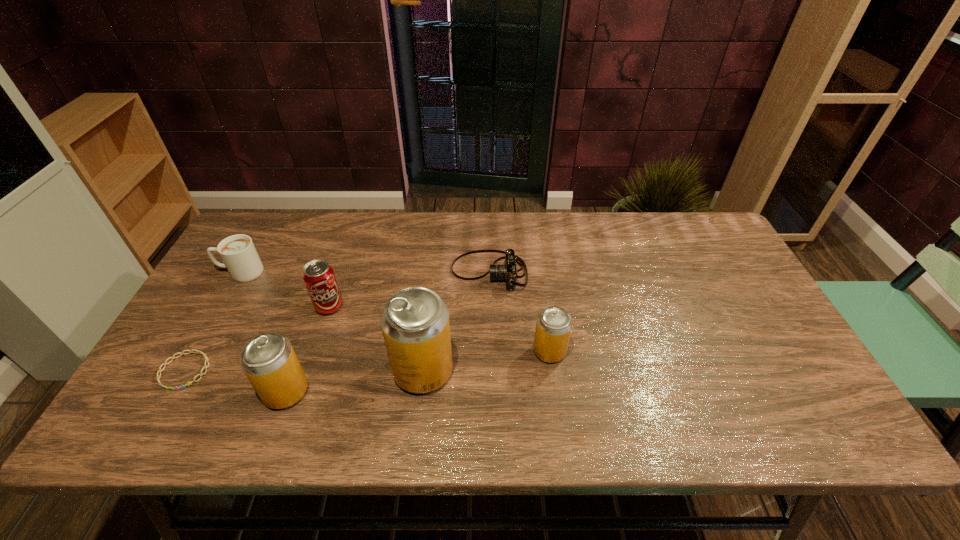
At what (x,y) coordinates should I click in order to perform the action: click on the tallest soda. Please return your answer as a coordinate pair (x, y). The image size is (960, 540). Looking at the image, I should click on (415, 323).

At what (x,y) coordinates should I click in order to perform the action: click on the second soda from right to left. Please return your answer as a coordinate pair (x, y). This screenshot has height=540, width=960. Looking at the image, I should click on (415, 323).

Where is `the rightmost soda`? the rightmost soda is located at coordinates (553, 328).

You are a GUI agent. You are given a task and a screenshot of the screen. Output one action in this format:
    pyautogui.click(x=<x>, y=<y>)
    Task: Click on the camera
    
    Given the screenshot: What is the action you would take?
    click(x=507, y=272)

Locate an element on the screen. Image resolution: width=960 pixels, height=540 pixels. the farthest soda is located at coordinates (318, 275).

This screenshot has height=540, width=960. I want to click on cappuccino, so click(x=238, y=252).

You are a GUI agent. You are given a task and a screenshot of the screen. Output one action in this format:
    pyautogui.click(x=<x>, y=<y>)
    Task: Click on the bracelet
    
    Given the screenshot: What is the action you would take?
    pyautogui.click(x=190, y=351)

Where is `free space located 0.240m on the left of the third soda from left to right`? The image size is (960, 540). free space located 0.240m on the left of the third soda from left to right is located at coordinates (294, 370).

You are a GUI agent. You are given a task and a screenshot of the screen. Output one action in this format:
    pyautogui.click(x=<x>, y=<y>)
    Task: Click on the vacant space located on the right of the rightmost soda
    
    Given the screenshot: What is the action you would take?
    pyautogui.click(x=682, y=351)

I want to click on free location located on the front-facing side of the second shortest object, so click(x=358, y=272).